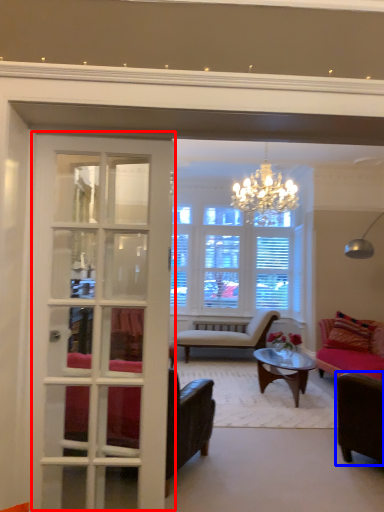
Question: Which object appears closest to the camera in this image, door (highlighted by a red box) or chair (highlighted by a blue box)?

Choices:
 (A) door
 (B) chair

Answer: (A)